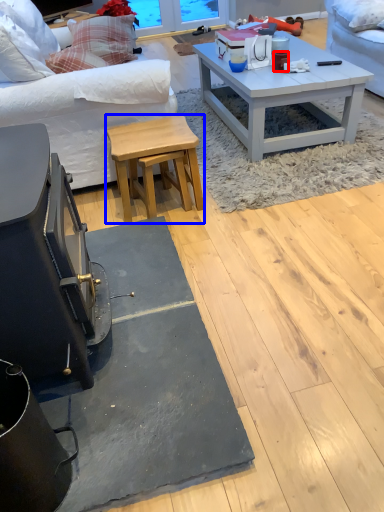
Question: Which point is further to the camera, coffee cup (highlighted by a red box) or stool (highlighted by a blue box)?

Choices:
 (A) coffee cup
 (B) stool

Answer: (A)